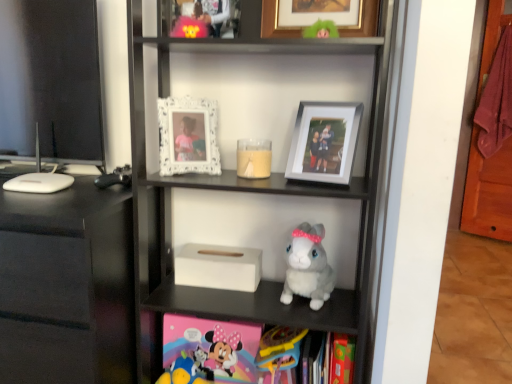
Question: Which direction should I rotate to look at fluffy gray plush at center, arranged as the first toy when viewed from the right?

Choices:
 (A) left
 (B) right

Answer: (B)

Question: Is white matte tissue box at center bigger than white matte tissue box at center?

Choices:
 (A) no
 (B) yes

Answer: (A)

Question: Is white matte tissue box at center far from white matte tissue box at center?

Choices:
 (A) yes
 (B) no

Answer: (B)

Question: Considering the relative sizes of white matte tissue box at center and white matte tissue box at center in the image provided, is white matte tissue box at center thinner than white matte tissue box at center?

Choices:
 (A) yes
 (B) no

Answer: (A)

Question: Does white matte tissue box at center have a greater width compared to white matte tissue box at center?

Choices:
 (A) yes
 (B) no

Answer: (B)

Question: Is white matte tissue box at center to the right of white matte tissue box at center from the viewer's perspective?

Choices:
 (A) no
 (B) yes

Answer: (A)

Question: From the image's perspective, does white matte tissue box at center appear lower than white matte tissue box at center?

Choices:
 (A) no
 (B) yes

Answer: (B)

Question: Is white matte tissue box at center directly adjacent to translucent glass candle at center?

Choices:
 (A) no
 (B) yes

Answer: (A)

Question: Is white matte tissue box at center facing towards translucent glass candle at center?

Choices:
 (A) no
 (B) yes

Answer: (A)

Question: Is white matte tissue box at center to the left of translucent glass candle at center from the viewer's perspective?

Choices:
 (A) yes
 (B) no

Answer: (A)

Question: Considering the relative sizes of white matte tissue box at center and translucent glass candle at center in the image provided, is white matte tissue box at center thinner than translucent glass candle at center?

Choices:
 (A) no
 (B) yes

Answer: (A)

Question: Considering the relative positions of white matte tissue box at center and translucent glass candle at center in the image provided, is white matte tissue box at center to the right of translucent glass candle at center from the viewer's perspective?

Choices:
 (A) yes
 (B) no

Answer: (B)

Question: Is white matte tissue box at center in front of translucent glass candle at center?

Choices:
 (A) no
 (B) yes

Answer: (A)

Question: Is matte burgundy towel at right not inside white matte tissue box at center?

Choices:
 (A) yes
 (B) no

Answer: (A)